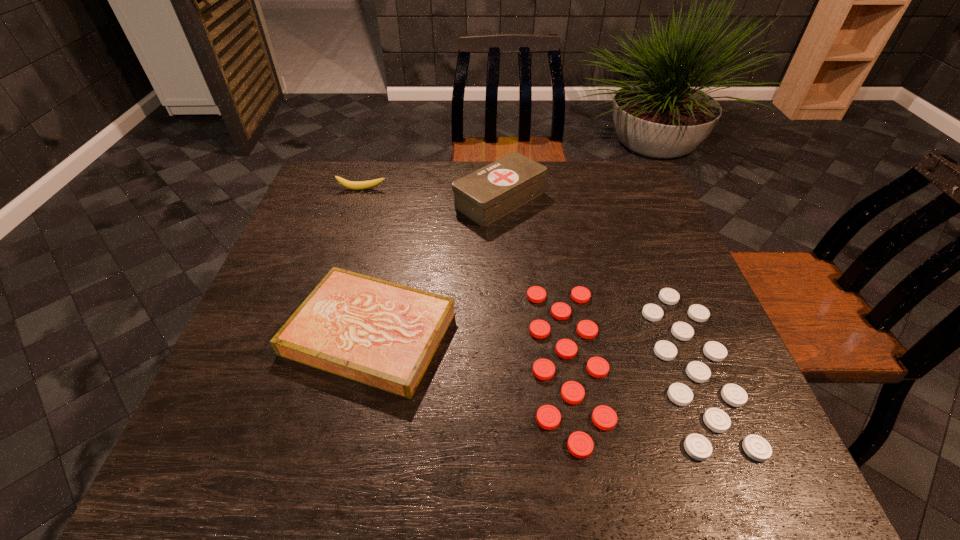
You are a GUI agent. You are given a task and a screenshot of the screen. Output one action in this format:
    pyautogui.click(x=<x>, y=<y>)
    Task: Click on the first-aid kit
    
    Given the screenshot: What is the action you would take?
    pyautogui.click(x=485, y=195)

Where is `banana`? The width and height of the screenshot is (960, 540). banana is located at coordinates (354, 185).

The image size is (960, 540). What are the coordinates of `hardback book` in the screenshot? It's located at (382, 334).

Locate an element on the screen. The width and height of the screenshot is (960, 540). the shortest object is located at coordinates (580, 444).

Where is `vacant space located on the right of the first-aid kit`? This screenshot has height=540, width=960. vacant space located on the right of the first-aid kit is located at coordinates (631, 199).

Locate an element on the screen. vacant region located on the upward curve of the banana is located at coordinates (347, 234).

Locate an element on the screen. Image resolution: width=960 pixels, height=540 pixels. free location located 0.060m on the right of the hardback book is located at coordinates coord(483,333).

Where is `free space located 0.060m on the back of the shortest object`? The image size is (960, 540). free space located 0.060m on the back of the shortest object is located at coordinates (604, 271).

Locate an element on the screen. This screenshot has height=540, width=960. the first-aid kit that is at the far edge is located at coordinates (485, 195).

Find the location of a particular element. banana at the far edge is located at coordinates tap(354, 185).